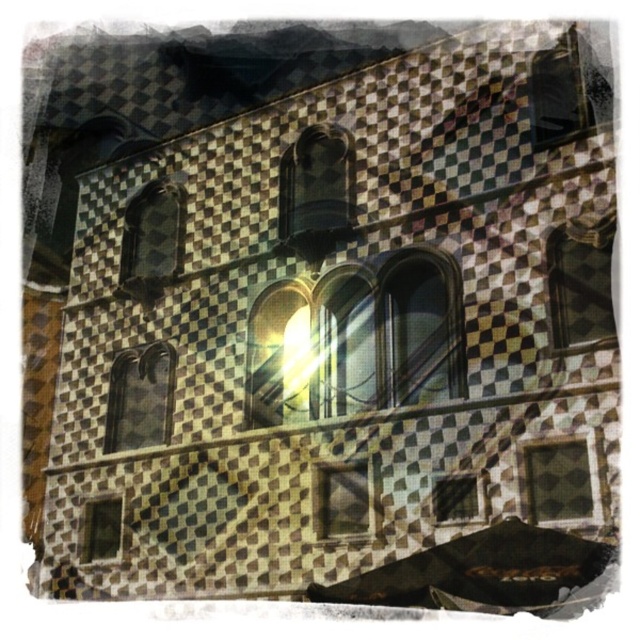
Does clear glass window at center have a greater width compared to matte glass window at center left?

Yes, clear glass window at center is wider than matte glass window at center left.

Is point (332, 230) positioned before point (120, 442)?

That is True.

What are the coordinates of `clear glass window at center` in the screenshot? It's located at (316, 182).

Where is `clear glass window at center`? The width and height of the screenshot is (640, 640). clear glass window at center is located at coordinates (316, 182).

Is matte checkered glass window at lower right taller than matte glass window at upper left?

Correct, matte checkered glass window at lower right is much taller as matte glass window at upper left.

Which is below, matte checkered glass window at lower right or matte glass window at upper left?

matte checkered glass window at lower right

The height and width of the screenshot is (640, 640). Describe the element at coordinates (557, 477) in the screenshot. I see `matte checkered glass window at lower right` at that location.

The width and height of the screenshot is (640, 640). What are the coordinates of `matte checkered glass window at lower right` in the screenshot? It's located at (557, 477).

Which is above, matte glass window at upper right or matte glass window at upper left?

matte glass window at upper left is above.

This screenshot has height=640, width=640. In order to click on matte glass window at upper right in this screenshot , I will do pyautogui.click(x=580, y=284).

Where is `matte glass window at upper right`? matte glass window at upper right is located at coordinates (580, 284).